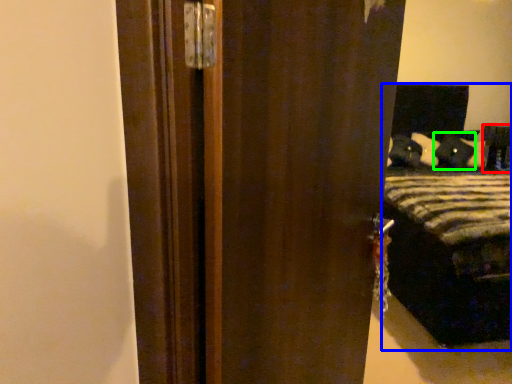
Question: Which is farther away from furniture (highlighted by a red box)? bed (highlighted by a blue box) or pillow (highlighted by a green box)?

Choices:
 (A) bed
 (B) pillow

Answer: (A)